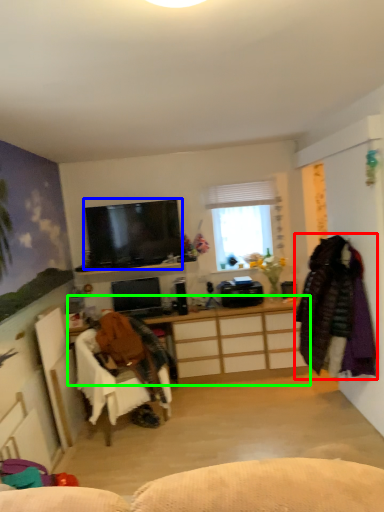
Question: Estimate the real-world distances between objects in this image. Which object is farther from clothing (highlighted by a red box), television (highlighted by a blue box) or cabinetry (highlighted by a green box)?

Choices:
 (A) television
 (B) cabinetry

Answer: (A)